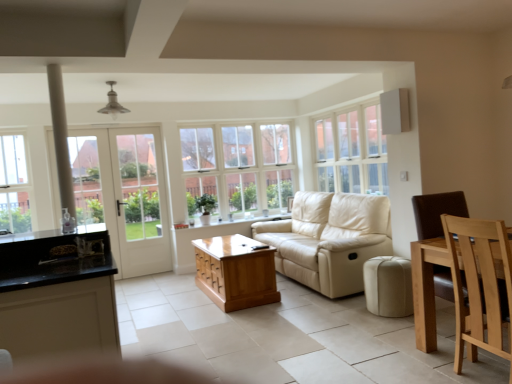
Question: Is brown wooden chair at right positioned far away from wooden coffee table at center?

Choices:
 (A) no
 (B) yes

Answer: (B)

Question: From the image's perspective, would you say brown wooden chair at right is shown under wooden coffee table at center?

Choices:
 (A) no
 (B) yes

Answer: (A)

Question: From a real-world perspective, is brown wooden chair at right on wooden coffee table at center?

Choices:
 (A) no
 (B) yes

Answer: (B)

Question: Does brown wooden chair at right have a lesser height compared to wooden coffee table at center?

Choices:
 (A) no
 (B) yes

Answer: (A)

Question: Is brown wooden chair at right facing towards wooden coffee table at center?

Choices:
 (A) no
 (B) yes

Answer: (A)

Question: Is brown wooden chair at right surrounding wooden coffee table at center?

Choices:
 (A) yes
 (B) no

Answer: (B)

Question: Is the surface of white glass door at left in direct contact with brown wooden chair at right?

Choices:
 (A) yes
 (B) no

Answer: (B)

Question: Is white glass door at left surrounding brown wooden chair at right?

Choices:
 (A) yes
 (B) no

Answer: (B)

Question: Considering the relative sizes of white glass door at left and brown wooden chair at right in the image provided, is white glass door at left taller than brown wooden chair at right?

Choices:
 (A) no
 (B) yes

Answer: (B)

Question: Is white glass door at left wider than brown wooden chair at right?

Choices:
 (A) no
 (B) yes

Answer: (A)

Question: Considering the relative positions of white glass door at left and brown wooden chair at right in the image provided, is white glass door at left in front of brown wooden chair at right?

Choices:
 (A) yes
 (B) no

Answer: (B)

Question: Is there a large distance between white glass door at left and brown wooden chair at right?

Choices:
 (A) yes
 (B) no

Answer: (A)

Question: Considering the relative positions of beige leather ottoman at lower center and clear glass window at left, acting as the third window starting from the right, in the image provided, is beige leather ottoman at lower center in front of clear glass window at left, acting as the third window starting from the right,?

Choices:
 (A) yes
 (B) no

Answer: (A)